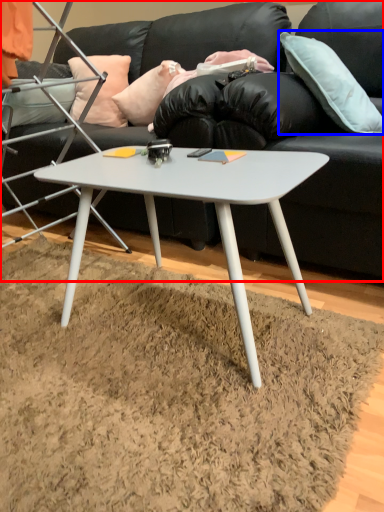
Question: Which object appears closest to the camera in this image, studio couch (highlighted by a red box) or pillow (highlighted by a blue box)?

Choices:
 (A) studio couch
 (B) pillow

Answer: (B)